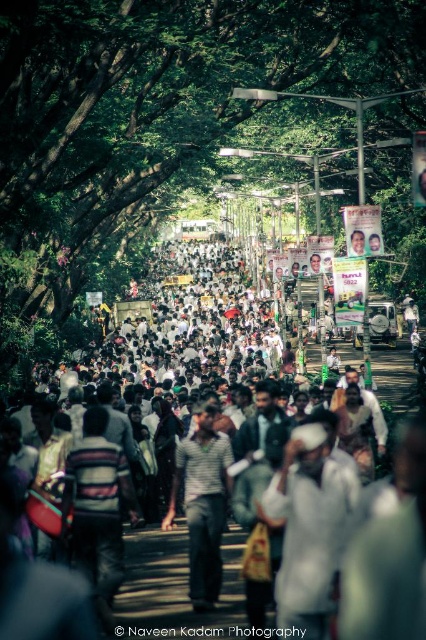
Can you confirm if green leafy tree at center is wider than white cotton shirt at center?

Indeed, green leafy tree at center has a greater width compared to white cotton shirt at center.

From the picture: Is green leafy tree at center bigger than white cotton shirt at center?

Yes, green leafy tree at center is bigger than white cotton shirt at center.

Who is more distant from viewer, (46, 134) or (293, 472)?

The point (46, 134) is more distant.

The width and height of the screenshot is (426, 640). In order to click on green leafy tree at center in this screenshot , I will do `click(149, 115)`.

Can you confirm if green leafy tree at center is thinner than striped fabric shirt at center?

No, green leafy tree at center is not thinner than striped fabric shirt at center.

Between green leafy tree at center and striped fabric shirt at center, which one appears on the right side from the viewer's perspective?

From the viewer's perspective, green leafy tree at center appears more on the right side.

Describe the element at coordinates (149, 115) in the screenshot. I see `green leafy tree at center` at that location.

Where is `green leafy tree at center`? Image resolution: width=426 pixels, height=640 pixels. green leafy tree at center is located at coordinates point(149,115).

Measure the distance from green leafy tree at center to white clothed crowd at center.

The distance of green leafy tree at center from white clothed crowd at center is 67.96 feet.

Between green leafy tree at center and white clothed crowd at center, which one has less height?

white clothed crowd at center is shorter.

Who is more forward, (52, 36) or (114, 420)?

Point (114, 420)

This screenshot has width=426, height=640. Identify the location of green leafy tree at center. (149, 115).